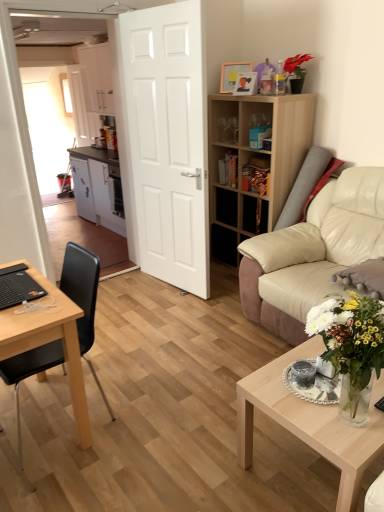
Where is `vacant space positioned to the left of white matte door at center`? vacant space positioned to the left of white matte door at center is located at coordinates (132, 290).